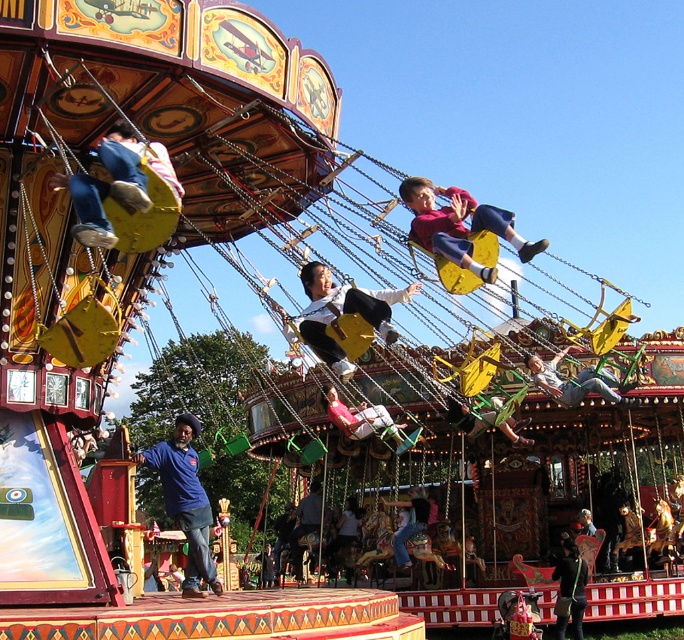
You are a photographer trying to capture a clear photo of the yellow fabric swing at center and the light blue denim jeans at center. However, you notice that one of them is blocking your view of the other. Which object is blocking the other?

The yellow fabric swing at center is blocking the view of the light blue denim jeans at center because it is positioned in front of it.

You are standing at the entrance of the amusement park and see the dark blue fabric jacket at center on the carousel. If the safety guidelines require visitors to stay at least 200 feet away from the carousel while it is operating, are you in compliance with the safety distance requirement?

The distance between you and the dark blue fabric jacket at center is 244.63 feet, which exceeds the minimum required distance of 200 feet. Therefore, you are in compliance with the safety guidelines.